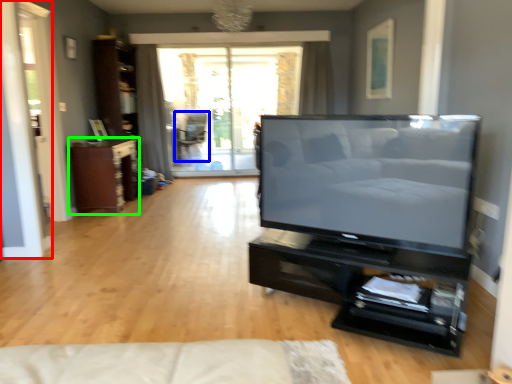
Question: Which object is the farthest from screen door (highlighted by a red box)? Choose among these: chair (highlighted by a blue box) or cabinetry (highlighted by a green box).

Choices:
 (A) chair
 (B) cabinetry

Answer: (A)